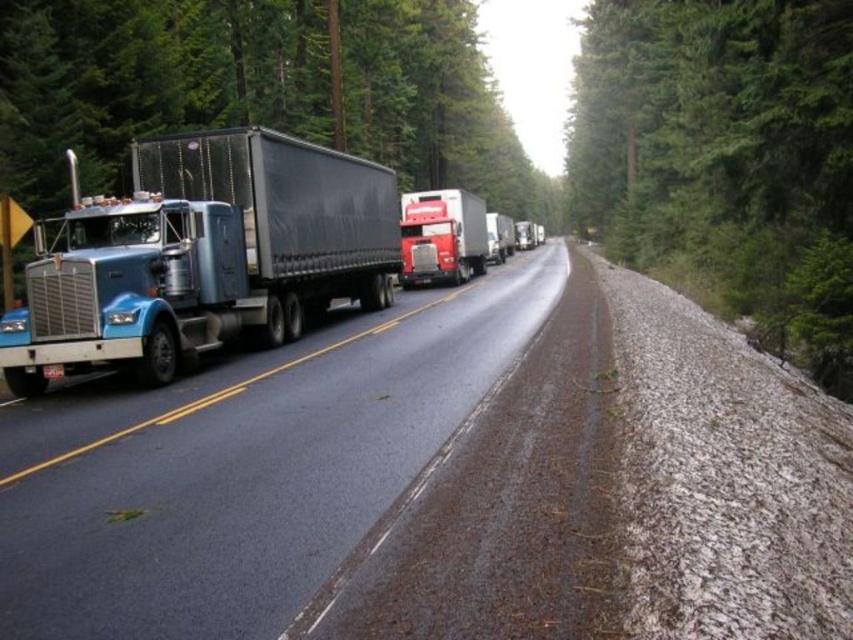
Question: Can you confirm if black rubber highway at center is positioned above blue metallic truck at left?

Choices:
 (A) no
 (B) yes

Answer: (B)

Question: Which of the following is the farthest from the observer?

Choices:
 (A) metallic blue trailer truck at left
 (B) shiny red truck at center
 (C) blue metallic truck at left

Answer: (B)

Question: Which is farther from the shiny red truck at center?

Choices:
 (A) metallic blue trailer truck at left
 (B) black matte truck at left
 (C) blue metallic truck at left

Answer: (B)

Question: Is black rubber highway at center smaller than metallic blue trailer truck at left?

Choices:
 (A) yes
 (B) no

Answer: (B)

Question: Among these points, which one is farthest from the camera?

Choices:
 (A) (322, 364)
 (B) (270, 372)
 (C) (608, 24)
 (D) (427, 260)

Answer: (C)

Question: Does black rubber highway at center come in front of green textured tree at right?

Choices:
 (A) yes
 (B) no

Answer: (A)